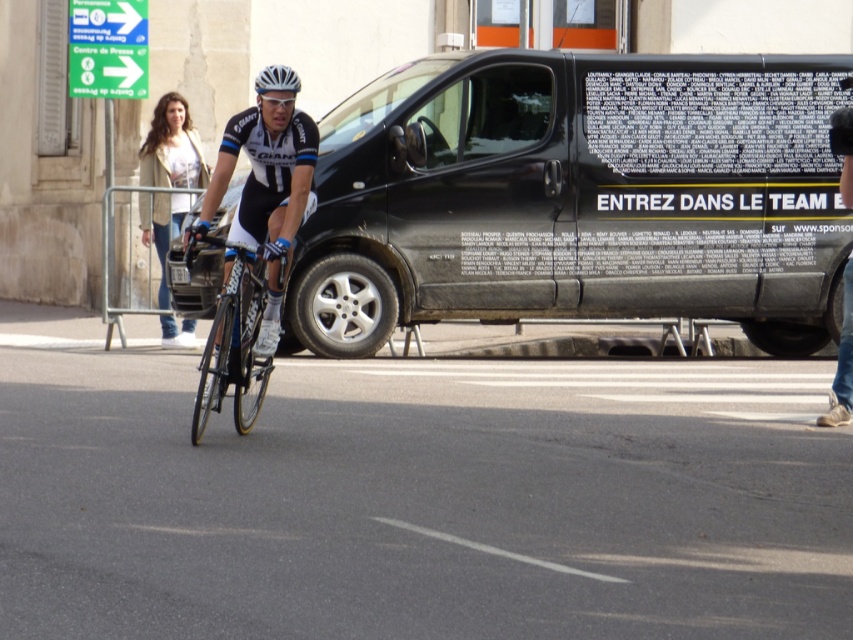
You are a photographer positioned on the side of the road capturing this cyclist and their surroundings. You notice the black matte van at center and the white matte helmet at center. From your perspective, which object is positioned more to the right?

The black matte van at center is positioned more to the right than the white matte helmet at center.

You are a photographer positioned at the side of the road capturing the cyclist midride. You notice the shiny blue frame at center and the white matte helmet at center. Which object is located lower in the image?

The shiny blue frame at center is positioned under the white matte helmet at center, so the shiny blue frame at center is lower in the image.

You are a delivery person who needs to place both the black matte van at center and the white matte helmet at center into a storage container. The container can only hold items that take up less space than the other. Which item should you place first?

The black matte van at center occupies less space than the white matte helmet at center, so you should place the white matte helmet at center first to ensure it fits in the container.